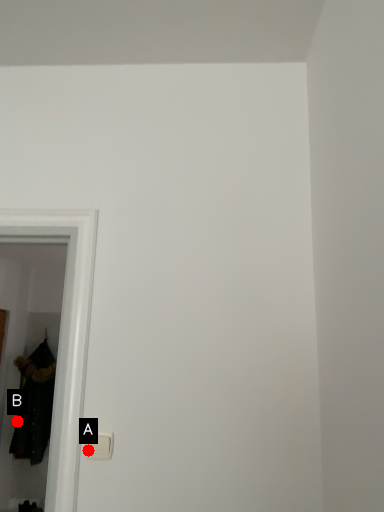
Question: Two points are circled on the image, labeled by A and B beside each circle. Which point appears farthest from the camera in this image?

Choices:
 (A) A is further
 (B) B is further

Answer: (B)